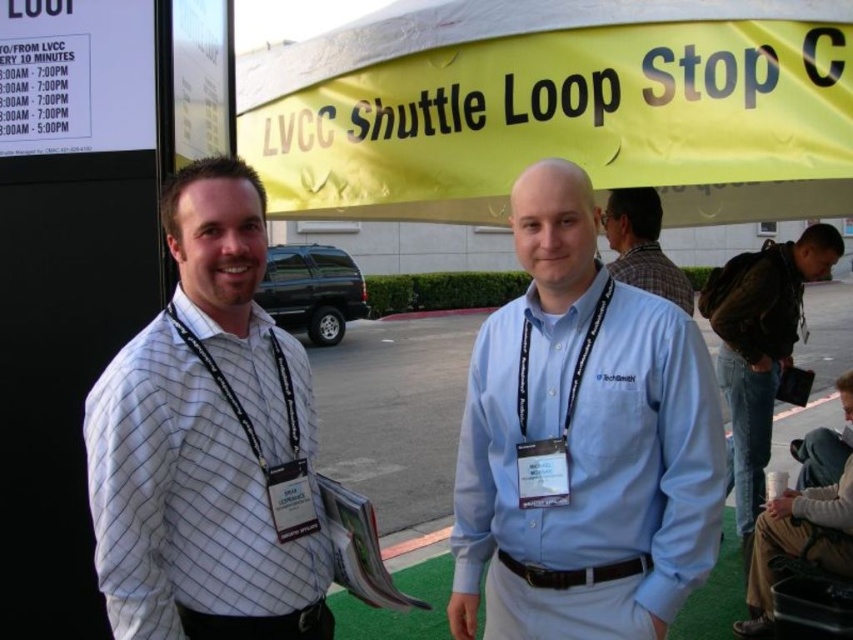
You are a photographer positioned at the back of the scene. You need to take a clear photo of both the black leather jacket at lower right and the light blue shirt at lower right. Which one should you focus on first to ensure it is in sharp focus?

You should focus on the black leather jacket at lower right first because it is closer to you than the light blue shirt at lower right, so focusing on it will ensure it is in sharp focus while the other may be slightly blurred.

In the scene shown: You are at the LVCC Shuttle Loop Stop C and need to ask for directions. There are two people in light blue shirt at center and plaid shirt at center. Which one is on the left side?

The light blue shirt at center is to the left of plaid shirt at center.